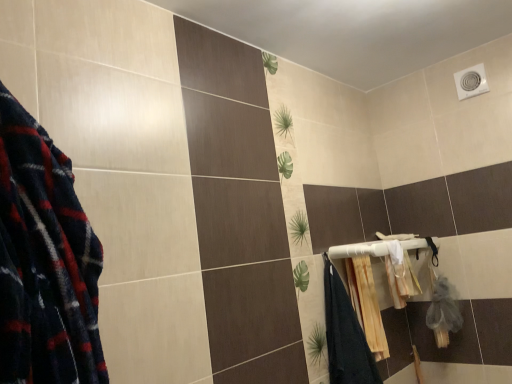
Question: Is white plastic towel bar at upper right wider or thinner than white fabric bath towel at lower right, placed as the 2th bath towel when sorted from left to right?

Choices:
 (A) wide
 (B) thin

Answer: (A)

Question: Considering the positions of white plastic towel bar at upper right and white fabric bath towel at lower right, placed as the 2th bath towel when sorted from left to right, in the image, is white plastic towel bar at upper right bigger or smaller than white fabric bath towel at lower right, placed as the 2th bath towel when sorted from left to right,?

Choices:
 (A) small
 (B) big

Answer: (B)

Question: Considering the real-world distances, which object is closest to the white fabric bath towel at lower right, which is counted as the 1th bath towel, starting from the right?

Choices:
 (A) beige textured towel at lower right, acting as the first bath towel starting from the left
 (B) white plastic towel bar at upper right

Answer: (B)

Question: Estimate the real-world distances between objects in this image. Which object is closer to the white fabric bath towel at lower right, placed as the 2th bath towel when sorted from left to right?

Choices:
 (A) beige textured towel at lower right, acting as the first bath towel starting from the left
 (B) white plastic towel bar at upper right

Answer: (B)